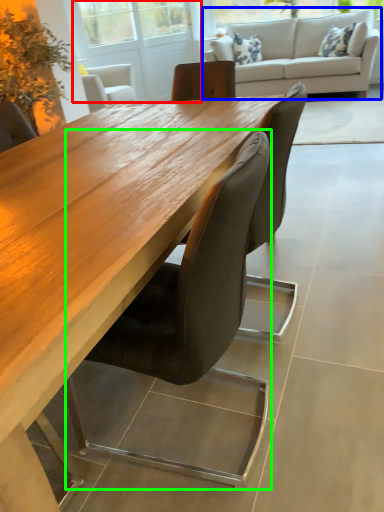
Question: Which is nearer to the screen door (highlighted by a red box)? studio couch (highlighted by a blue box) or chair (highlighted by a green box).

Choices:
 (A) studio couch
 (B) chair

Answer: (A)